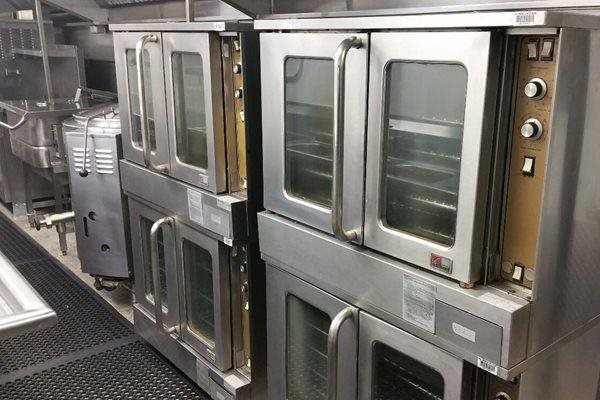
Identify the location of black handle knob. (83, 174).